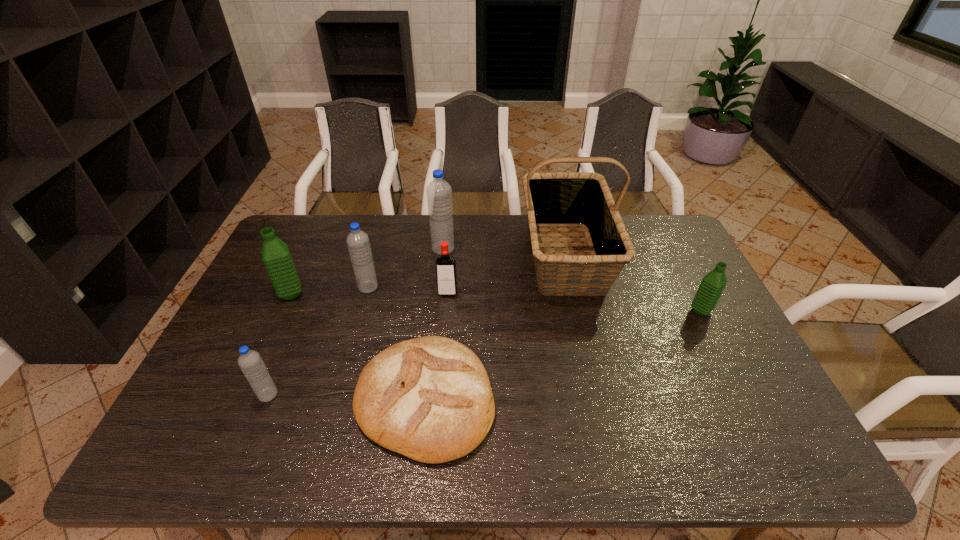
Identify the location of the tallest object. The height and width of the screenshot is (540, 960). click(553, 199).

Find the location of a particular element. the seventh object from left to right is located at coordinates (553, 199).

Where is `the rightmost blue water bottle`? The height and width of the screenshot is (540, 960). the rightmost blue water bottle is located at coordinates (439, 192).

This screenshot has height=540, width=960. In order to click on the tallest water bottle in this screenshot , I will do `click(439, 192)`.

Where is `the bigger green water bottle`? the bigger green water bottle is located at coordinates (276, 257).

Identify the location of the third water bottle from right to left. (357, 241).

I want to click on the second smallest blue water bottle, so pos(357,241).

You are a GUI agent. You are given a task and a screenshot of the screen. Output one action in this format:
    pyautogui.click(x=<x>, y=<y>)
    Task: Click on the vodka
    This screenshot has height=540, width=960.
    Given the screenshot: What is the action you would take?
    pyautogui.click(x=446, y=275)

Image resolution: width=960 pixels, height=540 pixels. Find the location of `the rightmost object`. the rightmost object is located at coordinates (711, 287).

Locate an element on the screen. The width and height of the screenshot is (960, 540). the smaller green water bottle is located at coordinates (711, 287).